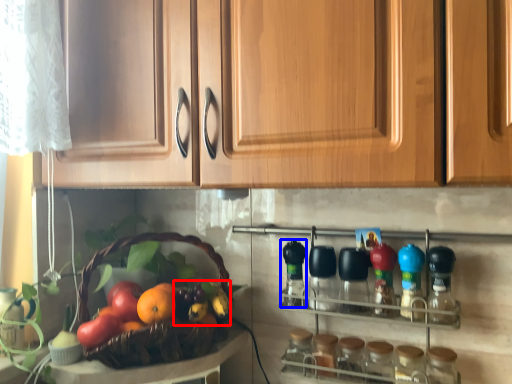
Question: Which point is closer to the camera, fruit (highlighted by a red box) or bottle (highlighted by a blue box)?

Choices:
 (A) fruit
 (B) bottle

Answer: (A)